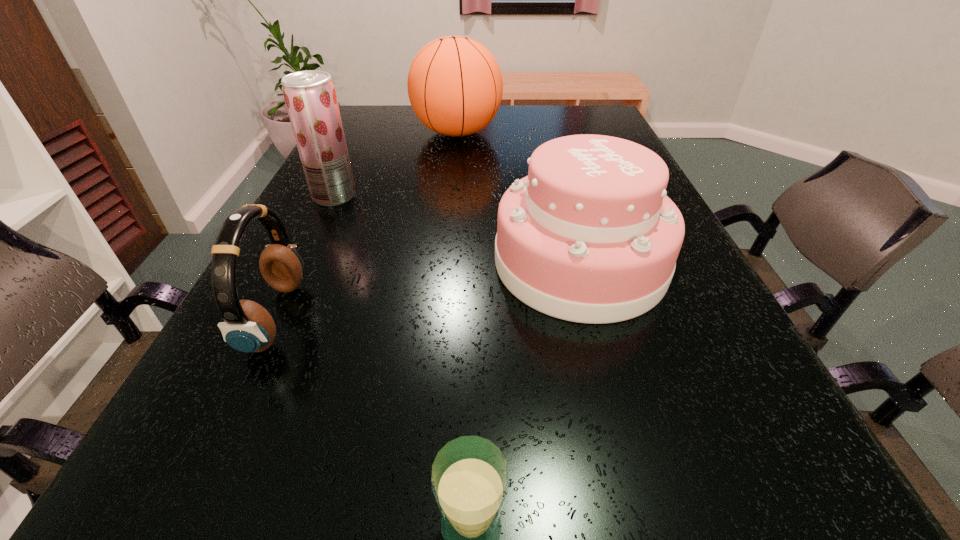
What are the coordinates of `fruit juice` in the screenshot? It's located at [310, 97].

Image resolution: width=960 pixels, height=540 pixels. Identify the location of the farthest object. (455, 86).

This screenshot has height=540, width=960. In order to click on birthday cake in this screenshot , I will do `click(589, 236)`.

The image size is (960, 540). Find the location of `headset`. headset is located at coordinates (248, 327).

Where is `vacant space located on the front of the fruit juice`? The width and height of the screenshot is (960, 540). vacant space located on the front of the fruit juice is located at coordinates 311,245.

This screenshot has width=960, height=540. Identify the location of free space located 0.160m on the left of the farthest object. (358, 132).

You are a GUI agent. You are given a task and a screenshot of the screen. Output one action in this format:
    pyautogui.click(x=<x>, y=<y>)
    Task: Click on the vacant space located 0.050m on the left of the birthday cake
    The width and height of the screenshot is (960, 540).
    Given the screenshot: What is the action you would take?
    pyautogui.click(x=468, y=262)

This screenshot has width=960, height=540. Identify the location of free space located on the ear cup of the headset. (513, 316).

At what (x,y) coordinates should I click in order to perform the action: click on object at the far edge. Please return your answer as a coordinate pair (x, y). Looking at the image, I should click on (455, 86).

I want to click on fruit juice that is at the left edge, so click(310, 97).